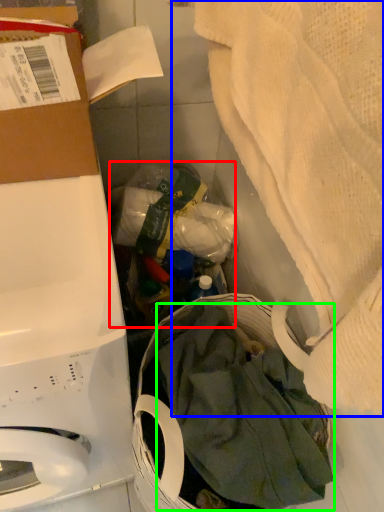
Question: Which object is positioned closest to garbage (highlighted by a red box)? Select from blanket (highlighted by a blue box) and clothing (highlighted by a green box).

Choices:
 (A) blanket
 (B) clothing

Answer: (B)